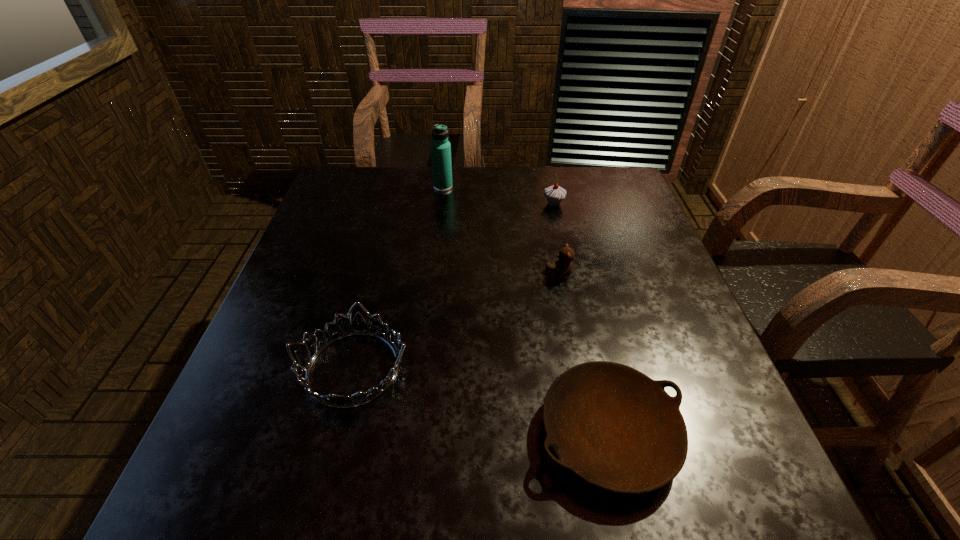
Where is `thermos bottle`? The width and height of the screenshot is (960, 540). thermos bottle is located at coordinates (440, 147).

Where is `the farthest object`? Image resolution: width=960 pixels, height=540 pixels. the farthest object is located at coordinates (440, 147).

Where is `the second farthest object`? the second farthest object is located at coordinates (554, 194).

Where is `the fourth shortest object`? The width and height of the screenshot is (960, 540). the fourth shortest object is located at coordinates 554,194.

This screenshot has height=540, width=960. Identify the location of teddy bear. (563, 267).

Image resolution: width=960 pixels, height=540 pixels. I want to click on tiara, so click(359, 326).

Find the location of `the shortest object`. the shortest object is located at coordinates (612, 426).

Identify the location of free space located on the front of the farthest object. (437, 243).

Find the location of a particular element. free space located 0.160m on the left of the cupcake is located at coordinates (486, 204).

Where is `vacant region located on the face of the teddy bear`? The width and height of the screenshot is (960, 540). vacant region located on the face of the teddy bear is located at coordinates (486, 275).